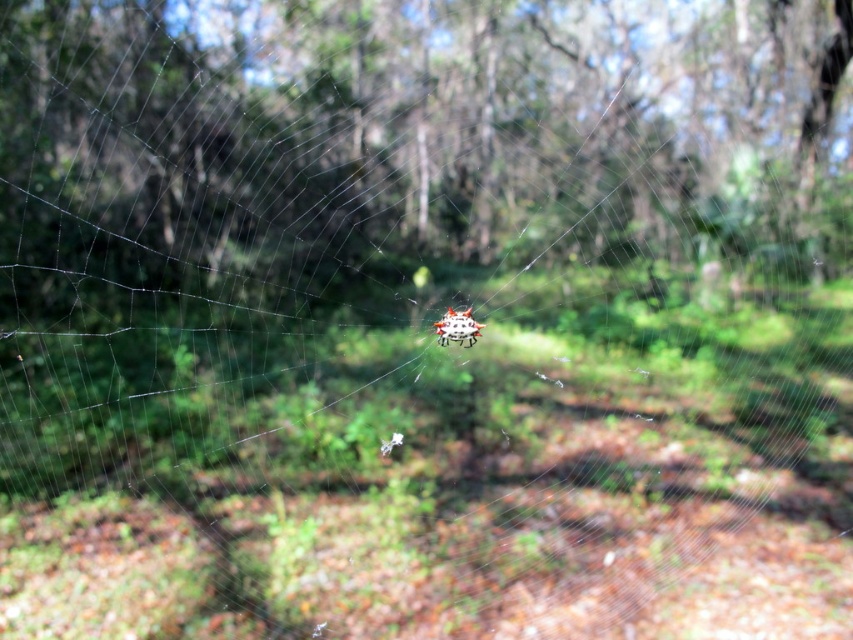
Question: Which object is closer to the camera taking this photo?

Choices:
 (A) translucent spiky orb at center
 (B) green leafy tree at center

Answer: (B)

Question: Can you confirm if green leafy tree at center is wider than translucent spiky orb at center?

Choices:
 (A) no
 (B) yes

Answer: (B)

Question: Is green leafy tree at center bigger than translucent spiky orb at center?

Choices:
 (A) no
 (B) yes

Answer: (B)

Question: Can you confirm if green leafy tree at center is positioned below translucent spiky orb at center?

Choices:
 (A) yes
 (B) no

Answer: (B)

Question: Which point is farther to the camera?

Choices:
 (A) (666, 35)
 (B) (469, 332)

Answer: (A)

Question: Among these points, which one is farthest from the camera?

Choices:
 (A) (x=462, y=326)
 (B) (x=96, y=19)

Answer: (B)